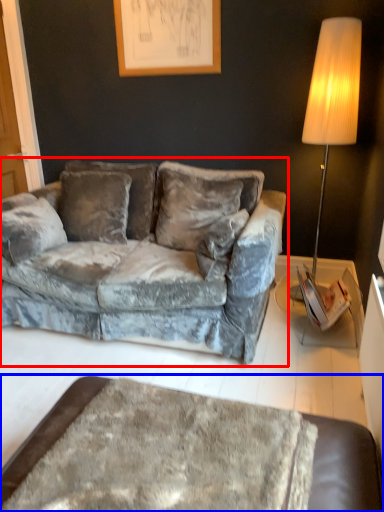
Question: Which object is closer to the camera taking this photo, studio couch (highlighted by a red box) or table (highlighted by a blue box)?

Choices:
 (A) studio couch
 (B) table

Answer: (B)